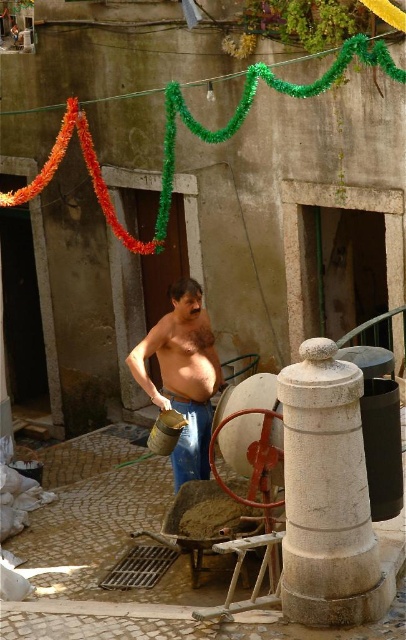
Is the position of white stone pillar at center more distant than that of blue denim jeans at center?

No, white stone pillar at center is closer to the viewer.

Can you confirm if white stone pillar at center is positioned to the right of blue denim jeans at center?

Yes, white stone pillar at center is to the right of blue denim jeans at center.

Where is `white stone pillar at center`? The width and height of the screenshot is (406, 640). white stone pillar at center is located at coordinates (328, 497).

Find the location of `white stone pillar at center`. white stone pillar at center is located at coordinates (328, 497).

Can you confirm if shiny metallic bucket at center is smaller than blue denim jeans at center?

Actually, shiny metallic bucket at center might be larger than blue denim jeans at center.

Between shiny metallic bucket at center and blue denim jeans at center, which one is positioned higher?

Positioned higher is shiny metallic bucket at center.

Does point (205, 396) come closer to viewer compared to point (189, 435)?

No, it is behind (189, 435).

You are a GUI agent. You are given a task and a screenshot of the screen. Output one action in this format:
    pyautogui.click(x=<x>, y=<y>)
    Task: Click on the shiny metallic bucket at center
    The width and height of the screenshot is (406, 640).
    Given the screenshot: What is the action you would take?
    pyautogui.click(x=183, y=376)

Between white stone pillar at center and shiny metallic bucket at center, which one appears on the right side from the viewer's perspective?

Positioned to the right is white stone pillar at center.

Looking at this image, can you confirm if white stone pillar at center is positioned above shiny metallic bucket at center?

Actually, white stone pillar at center is below shiny metallic bucket at center.

Does point (382, 561) come closer to viewer compared to point (151, 328)?

Yes, point (382, 561) is in front of point (151, 328).

I want to click on white stone pillar at center, so click(x=328, y=497).